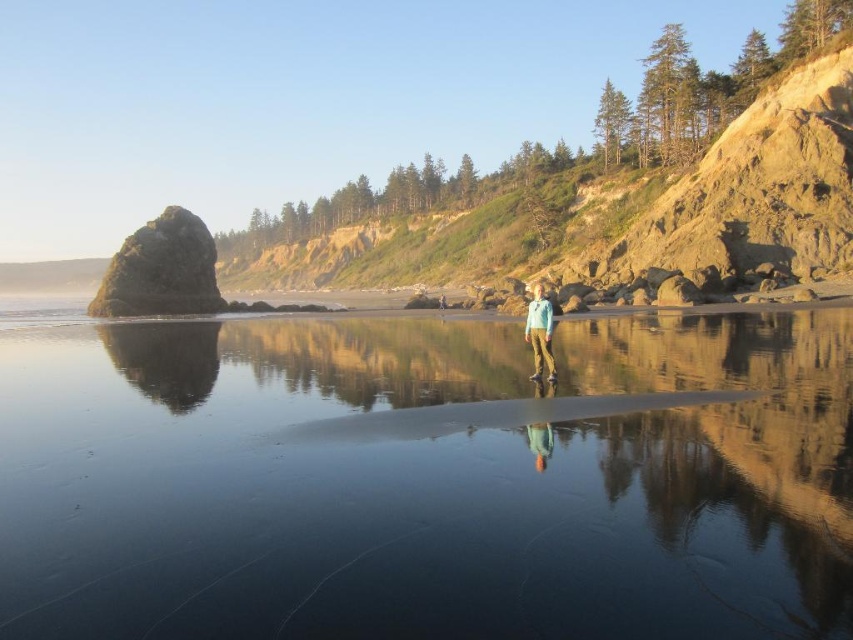
Is the position of glossy reflective water at center less distant than that of matte blue jacket at center?

Yes, it is.

Does point (277, 372) come closer to viewer compared to point (525, 330)?

Yes.

Find the location of a particular element. glossy reflective water at center is located at coordinates (426, 480).